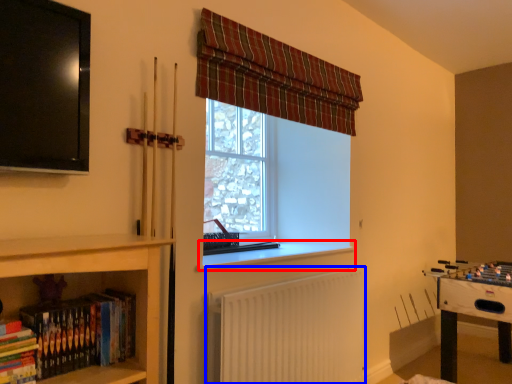
Question: Which of the following is the closest to the observer, window sill (highlighted by a red box) or radiator (highlighted by a blue box)?

Choices:
 (A) window sill
 (B) radiator

Answer: (B)